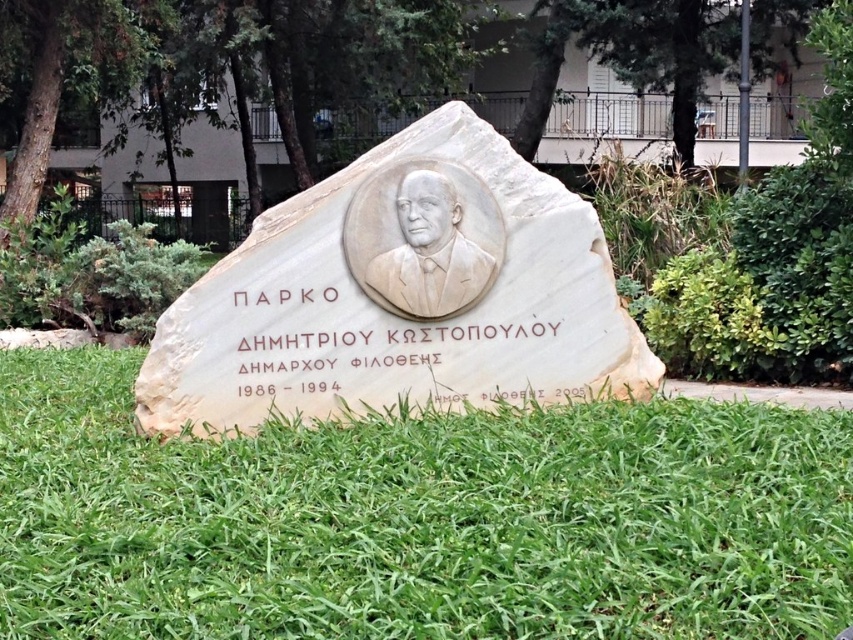
You are standing in front of the commemorative stone monument in the park. You see the green grass at center and the white marble plaque at center. Which object is closer to you?

The green grass at center is closer to you because it is in front of the white marble plaque at center.

You are a gardener who needs to mow the green grass at center and trim the white marble bust at center. Which object should you tackle first based on their heights?

The green grass at center is shorter than the white marble bust at center, so you should mow the green grass at center first before trimming the taller white marble bust at center.

In the scene shown: You are a visitor at the park and want to read the inscription on the white marble plaque at center. Where should you look in relation to the white marble bust at center?

The white marble plaque at center is positioned under the white marble bust at center, so you should look below the white marble bust at center to find the inscription.